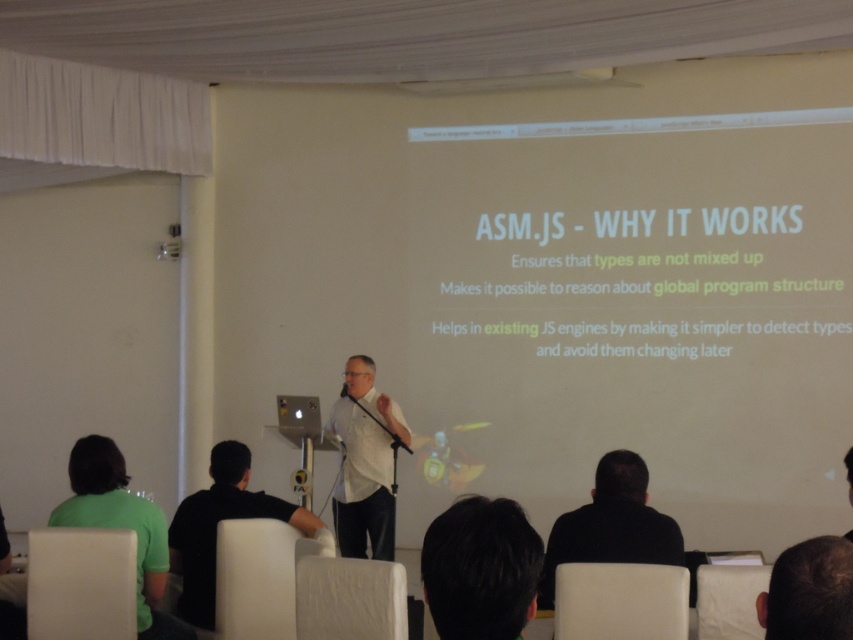
Is black hair at lower center positioned behind black shirt at lower center?

That is False.

Is point (479, 570) farther from camera compared to point (608, 509)?

That is False.

Find the location of a particular element. This screenshot has height=640, width=853. black hair at lower center is located at coordinates (480, 570).

Can you confirm if black hair at lower center is wider than dark brown hair at lower right?

Indeed, black hair at lower center has a greater width compared to dark brown hair at lower right.

Does black hair at lower center appear under dark brown hair at lower right?

Incorrect, black hair at lower center is not positioned below dark brown hair at lower right.

Is point (509, 556) less distant than point (785, 627)?

No, it is behind (785, 627).

Image resolution: width=853 pixels, height=640 pixels. Find the location of `black hair at lower center`. black hair at lower center is located at coordinates (480, 570).

Can you confirm if black hair at lower center is positioned below white matte shirt at center?

Incorrect, black hair at lower center is not positioned below white matte shirt at center.

Image resolution: width=853 pixels, height=640 pixels. What do you see at coordinates (480, 570) in the screenshot? I see `black hair at lower center` at bounding box center [480, 570].

Who is more distant from viewer, (469,630) or (372,390)?

The point (372,390) is more distant.

This screenshot has height=640, width=853. I want to click on black hair at lower center, so click(x=480, y=570).